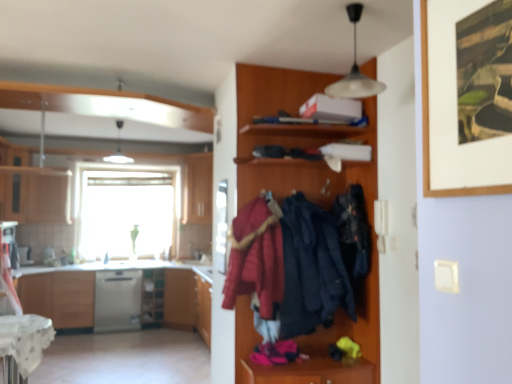
Question: Would you say dark blue fabric coat at center, which is counted as the 2th clothing, starting from the left, is to the left or to the right of white matte pendant light at upper center in the picture?

Choices:
 (A) left
 (B) right

Answer: (A)

Question: Is dark blue fabric coat at center, arranged as the 2th clothing when viewed from the right, in front of or behind white matte pendant light at upper center in the image?

Choices:
 (A) behind
 (B) front

Answer: (A)

Question: Which object is positioned closest to the white matte pendant light at upper center?

Choices:
 (A) dark blue fabric coat at center, arranged as the third clothing when viewed from the left
 (B) wooden framed artwork at upper right
 (C) white lace tablecloth at lower left
 (D) wooden shelf at lower left
 (E) wooden cabinet at center, acting as the first cabinetry starting from the right

Answer: (A)

Question: Based on their relative distances, which object is farther from the transparent glass window at center?

Choices:
 (A) white lace tablecloth at lower left
 (B) wooden shelf at lower left
 (C) satin silver dishwasher at center
 (D) matte wood cabinet at left, acting as the 2th cabinetry starting from the left
 (E) velvet red coat at center, acting as the third clothing starting from the right

Answer: (E)